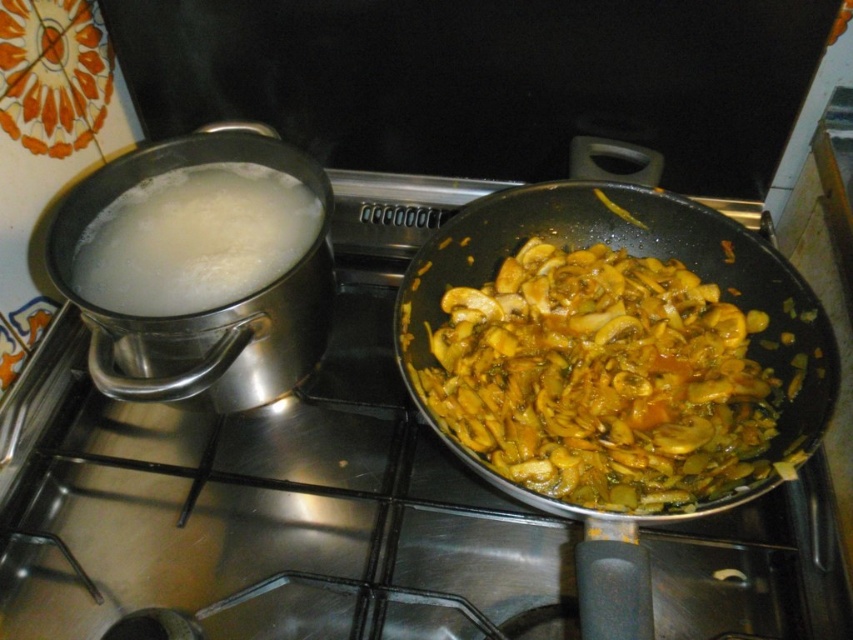
Looking at this image, between shiny black wok at center and white creamy liquid at left, which one is positioned lower?

Positioned lower is shiny black wok at center.

Image resolution: width=853 pixels, height=640 pixels. Describe the element at coordinates (577, 243) in the screenshot. I see `shiny black wok at center` at that location.

You are a GUI agent. You are given a task and a screenshot of the screen. Output one action in this format:
    pyautogui.click(x=<x>, y=<y>)
    Task: Click on the shiny black wok at center
    The width and height of the screenshot is (853, 640).
    Given the screenshot: What is the action you would take?
    pyautogui.click(x=577, y=243)

Can you confirm if yellowish-brown sautéed mushrooms at center-right is thinner than shiny black wok at center?

Yes.

From the picture: Can you confirm if yellowish-brown sautéed mushrooms at center-right is positioned to the left of shiny black wok at center?

Indeed, yellowish-brown sautéed mushrooms at center-right is positioned on the left side of shiny black wok at center.

Find the location of a particular element. Image resolution: width=853 pixels, height=640 pixels. yellowish-brown sautéed mushrooms at center-right is located at coordinates (602, 380).

The width and height of the screenshot is (853, 640). What are the coordinates of `yellowish-brown sautéed mushrooms at center-right` in the screenshot? It's located at (602, 380).

From the picture: Can you confirm if yellowish-brown sautéed mushrooms at center-right is thinner than white creamy liquid at left?

No, yellowish-brown sautéed mushrooms at center-right is not thinner than white creamy liquid at left.

Describe the element at coordinates (602, 380) in the screenshot. I see `yellowish-brown sautéed mushrooms at center-right` at that location.

Describe the element at coordinates (602, 380) in the screenshot. I see `yellowish-brown sautéed mushrooms at center-right` at that location.

At what (x,y) coordinates should I click in order to perform the action: click on yellowish-brown sautéed mushrooms at center-right. Please return your answer as a coordinate pair (x, y). This screenshot has width=853, height=640. Looking at the image, I should click on (602, 380).